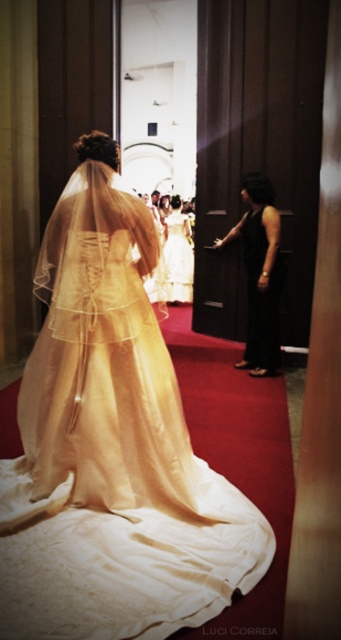
Is black satin dress at right closer to the viewer compared to white satin dress at center?

Yes, it is in front of white satin dress at center.

Who is more distant from viewer, [267,209] or [169,269]?

Point [169,269]

The image size is (341, 640). I want to click on black satin dress at right, so click(x=259, y=273).

Who is shorter, ivory satin gown at center or black satin dress at right?

With less height is black satin dress at right.

Is point (147, 355) closer to viewer compared to point (255, 358)?

That is True.

Where is `ivory satin gown at center`? ivory satin gown at center is located at coordinates (111, 445).

The height and width of the screenshot is (640, 341). What do you see at coordinates (111, 445) in the screenshot?
I see `ivory satin gown at center` at bounding box center [111, 445].

Is ivory satin gown at center smaller than white satin dress at center?

No.

The height and width of the screenshot is (640, 341). I want to click on ivory satin gown at center, so click(x=111, y=445).

Locate an element on the screen. This screenshot has width=341, height=640. ivory satin gown at center is located at coordinates (111, 445).